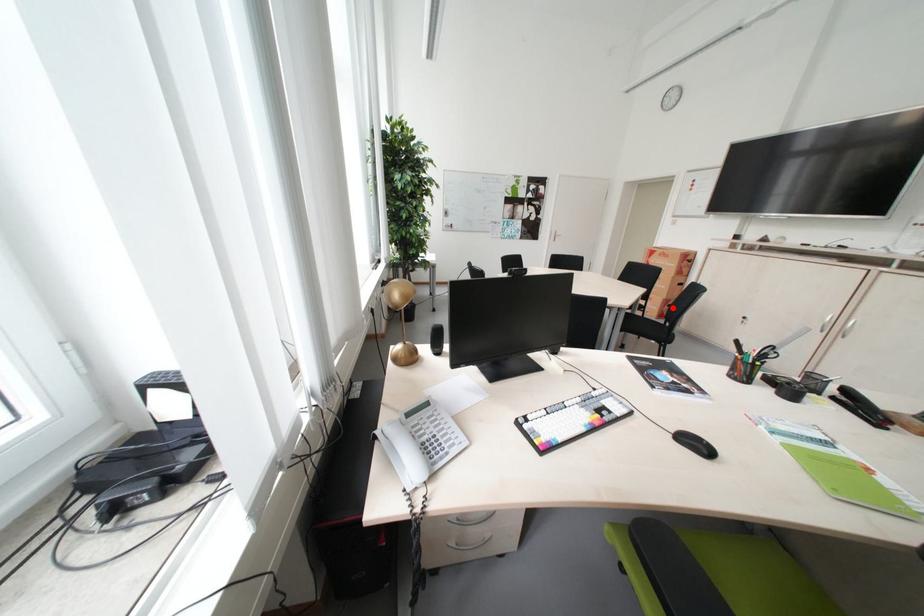
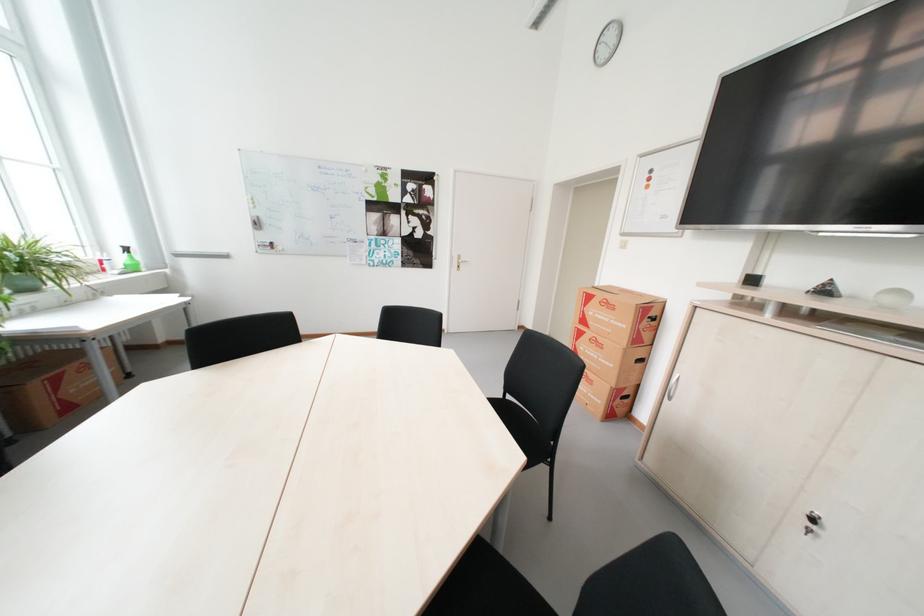
Question: I am providing you with two images of the same scene from different viewpoints. Given a red point in image1, look at the same physical point in image2. Is it:

Choices:
 (A) Closer to the viewpoint
 (B) Farther from the viewpoint

Answer: (A)